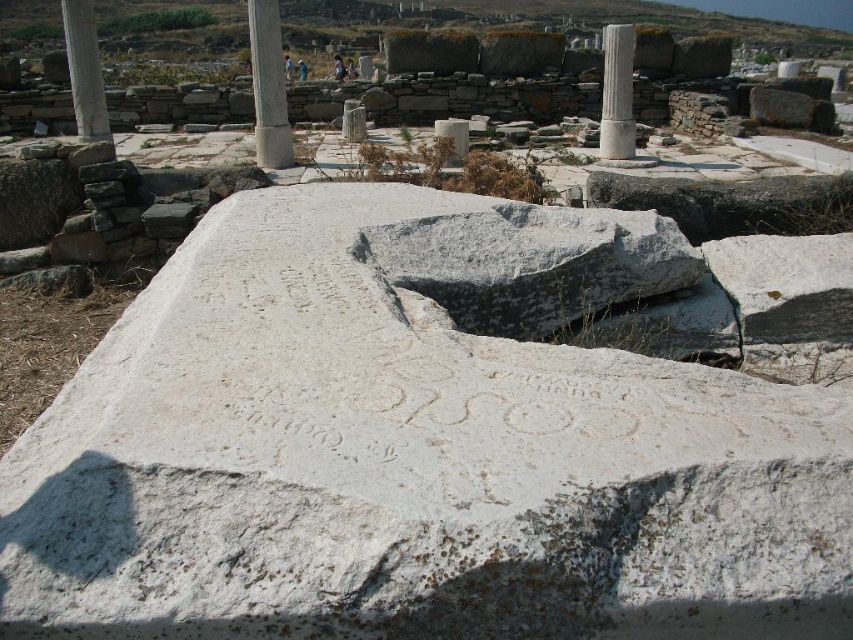
You are an archaeologist examining the ancient site. You notice a white stone at center marked by point (418,444). What is the significance of this point in relation to the stone?

The point (418,444) represents the location of the white stone at center.

Based on the photo, you are an archaeologist examining the site. You need to determine which object is bigger between the white stone at center and the white stone column at center. Which one is larger?

The white stone at center is larger than the white stone column at center.